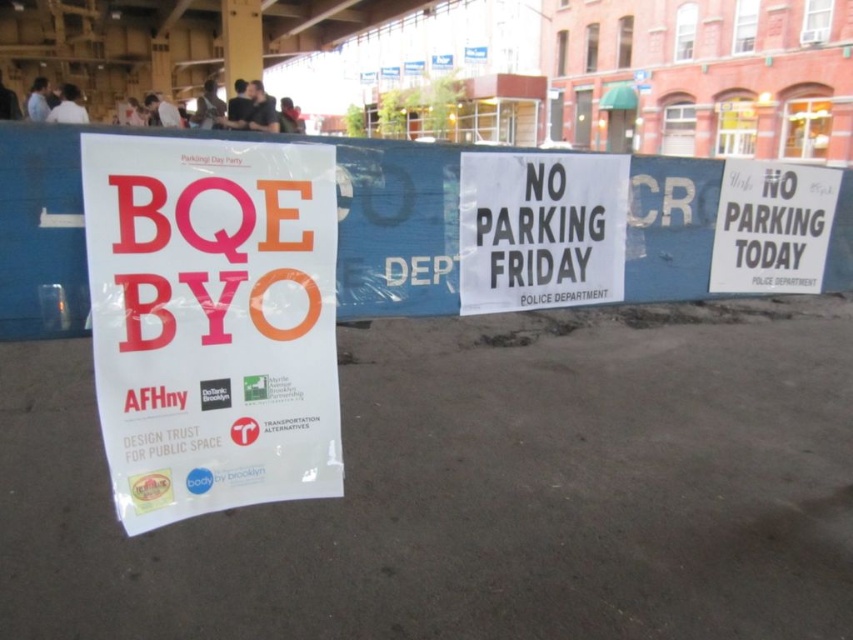
You are a pedestrian standing in front of the blue barricade. You see a white paper poster at center and a white paper sign at center. Which one is taller?

The white paper poster at center is much taller than the white paper sign at center.

Consider the image. You are a delivery person who needs to place a 24 inch box between the white paper poster at center and the white paper sign at center. Can the box fit between them?

The white paper poster at center is 31.77 inches away from the white paper sign at center. Since the box is 24 inches long, it can fit between them as the distance is sufficient.

You are standing at the base of the bridge and want to determine the relative positions of two points marked in the scene. Which point is closer to you, point at coordinate [152,202] or point at coordinate [340,307]?

Point at coordinate [152,202] is closer to the viewer than point at coordinate [340,307].